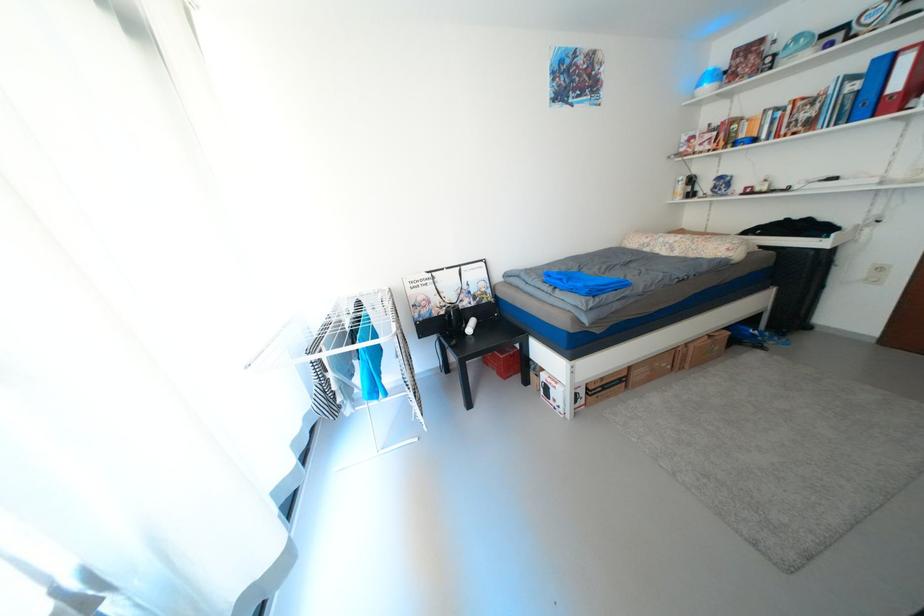
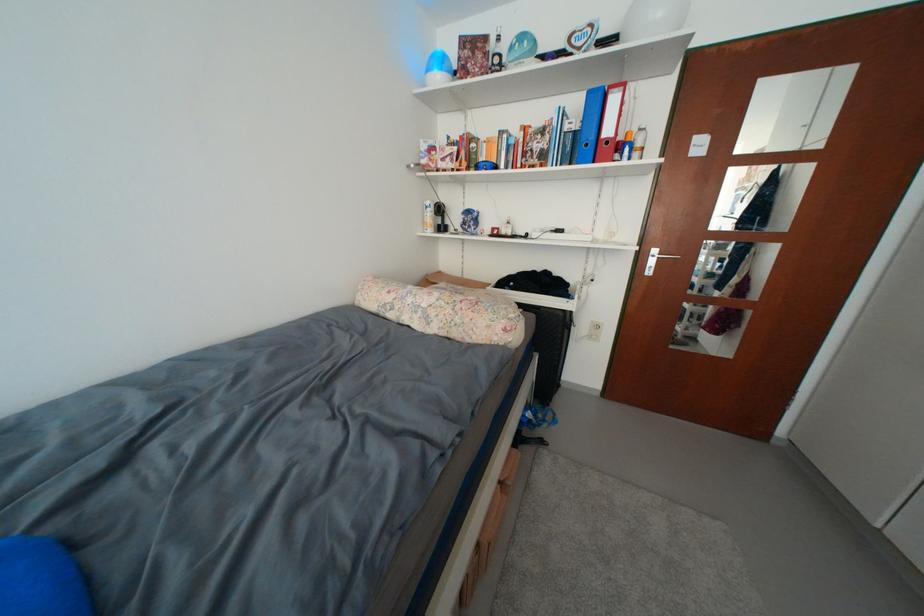
Find the pixel in the second image that matches pixel 857 110 in the first image.

(578, 151)